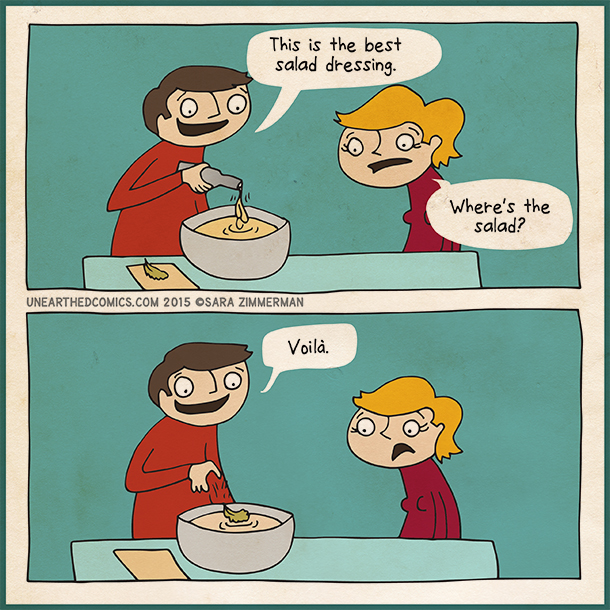
Image resolution: width=610 pixels, height=610 pixels. I want to click on bottle, so click(x=207, y=178).